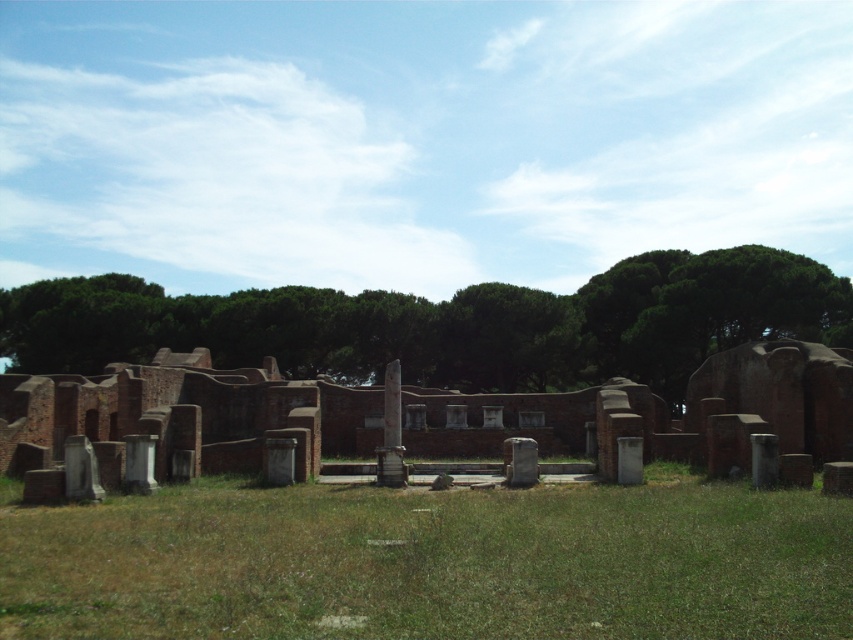
Question: Observing the image, what is the correct spatial positioning of green leafy tree at center in reference to brick wall at center?

Choices:
 (A) below
 (B) above

Answer: (B)

Question: Can you confirm if green grass at center is smaller than brick wall at center?

Choices:
 (A) no
 (B) yes

Answer: (B)

Question: Which point is farther to the camera?

Choices:
 (A) (831, 392)
 (B) (492, 545)
 (C) (712, 349)

Answer: (C)

Question: Which object is the closest to the green grass at center?

Choices:
 (A) brick wall at center
 (B) green leafy tree at center

Answer: (A)

Question: Can you confirm if green leafy tree at center is wider than brick wall at center?

Choices:
 (A) yes
 (B) no

Answer: (A)

Question: Which object is the closest to the brick wall at center?

Choices:
 (A) green leafy tree at center
 (B) green grass at center

Answer: (B)